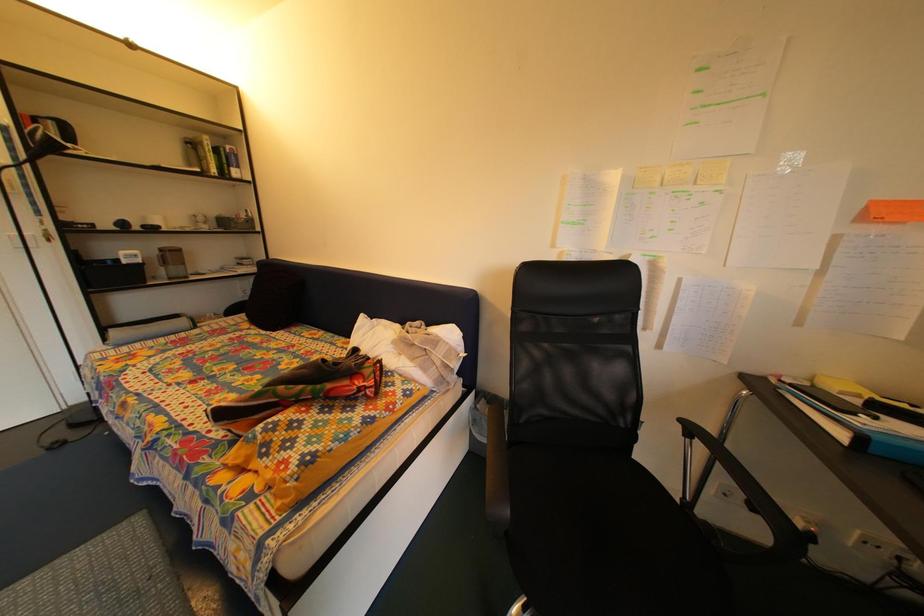
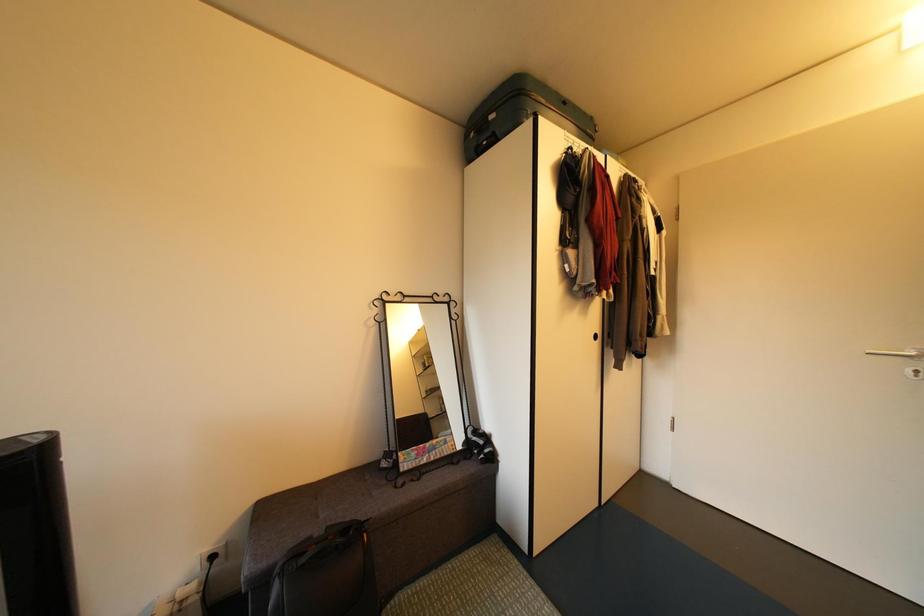
Question: How did the camera likely rotate?

Choices:
 (A) Left
 (B) Right
 (C) Up
 (D) Down

Answer: (A)